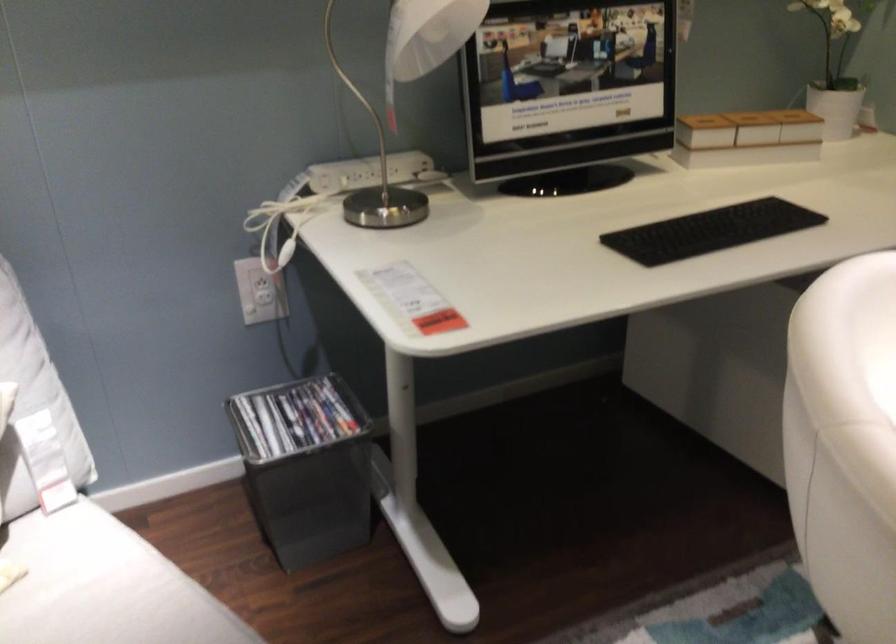
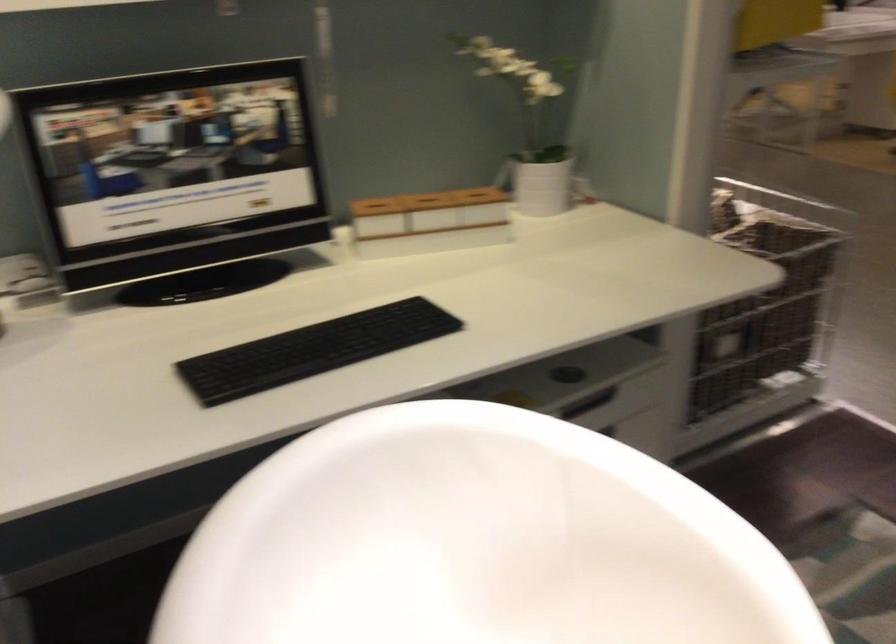
Question: The camera is either moving clockwise (left) or counter-clockwise (right) around the object. The first image is from the beginning of the video and the second image is from the end. Is the camera moving left or right when shooting the video?

Choices:
 (A) Left
 (B) Right

Answer: (A)